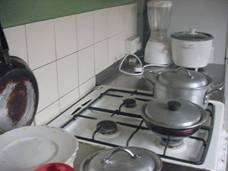
Image resolution: width=228 pixels, height=171 pixels. Identify the location of blender. (160, 52).